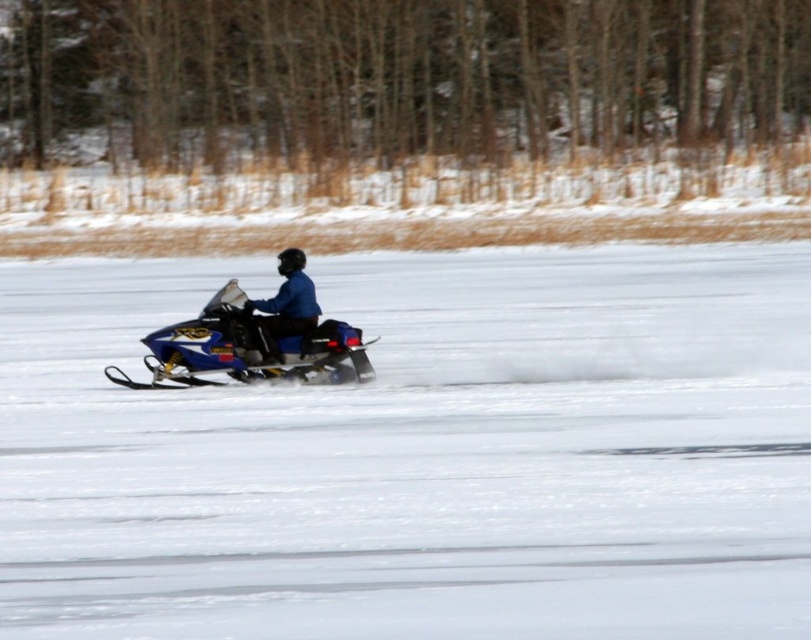
Does blue metallic snowmobile at center appear over blue matte snowmobile at center?

Actually, blue metallic snowmobile at center is below blue matte snowmobile at center.

From the picture: Can you confirm if blue metallic snowmobile at center is thinner than blue matte snowmobile at center?

No, blue metallic snowmobile at center is not thinner than blue matte snowmobile at center.

Identify the location of blue metallic snowmobile at center. The height and width of the screenshot is (640, 811). (247, 348).

At what (x,y) coordinates should I click in order to perform the action: click on blue metallic snowmobile at center. Please return your answer as a coordinate pair (x, y). This screenshot has height=640, width=811. Looking at the image, I should click on (247, 348).